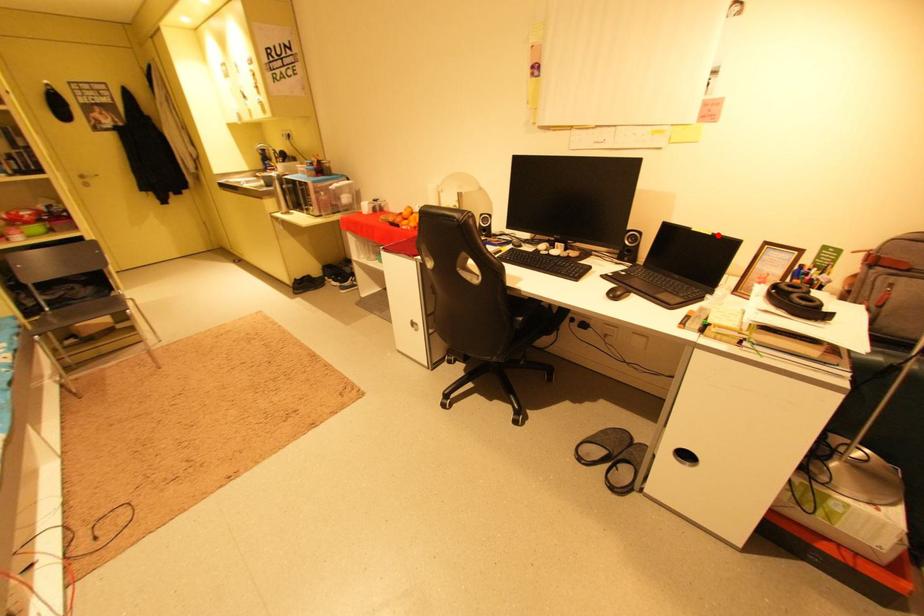
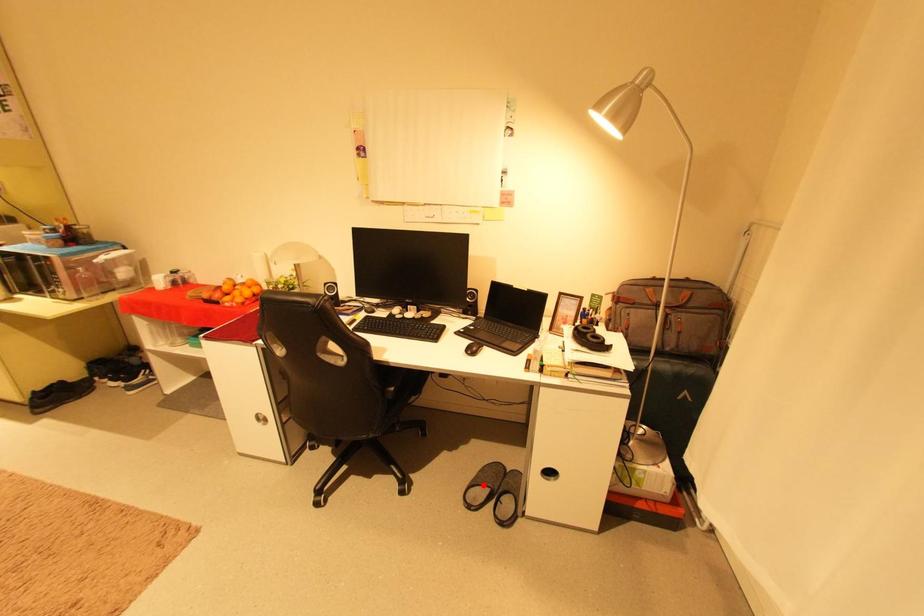
I am providing you with two images of the same scene from different viewpoints. A red point is marked on the first image and another point is marked on the second image. Does the point marked in image1 correspond to the same location as the one in image2?

No